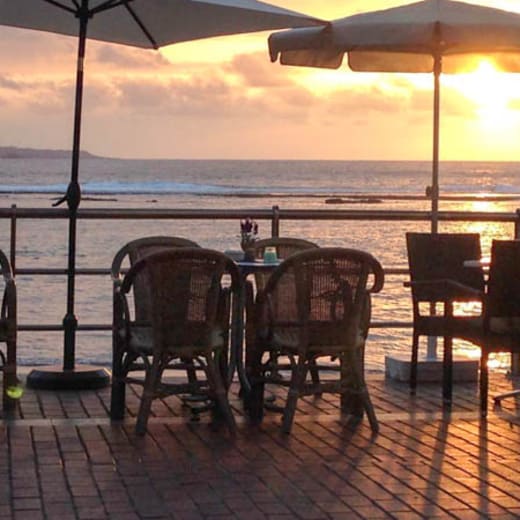
This screenshot has height=520, width=520. Find the location of `metallic umbrella base`. metallic umbrella base is located at coordinates (55, 381).